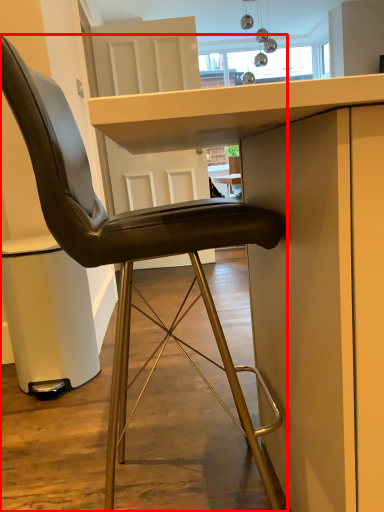
Question: Where is chair (annotated by the red box) located in relation to table in the image?

Choices:
 (A) left
 (B) right

Answer: (A)